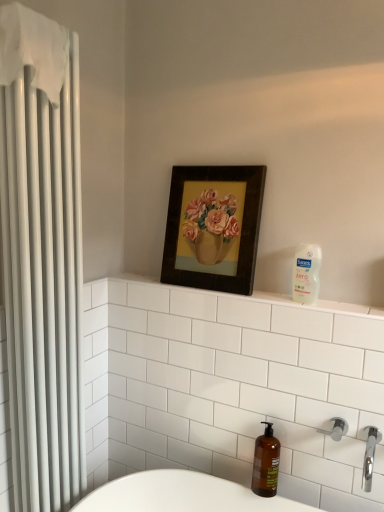
Question: Relative to amber glass soap dispenser at lower right, is satin nickel shower at lower right in front or behind?

Choices:
 (A) behind
 (B) front

Answer: (B)

Question: From the image's perspective, is satin nickel shower at lower right above or below amber glass soap dispenser at lower right?

Choices:
 (A) below
 (B) above

Answer: (B)

Question: Which is nearer to the wooden framed painting of flowers at upper center?

Choices:
 (A) white plastic bottle at upper right
 (B) clear plastic soap dispenser at upper right
 (C) white fabric shower curtain at left
 (D) chrome metallic faucet at lower right
 (E) satin nickel shower at lower right

Answer: (B)

Question: Which object is the farthest from the white fabric shower curtain at left?

Choices:
 (A) amber glass soap dispenser at lower right
 (B) white plastic bottle at upper right
 (C) satin nickel shower at lower right
 (D) chrome metallic faucet at lower right
 (E) clear plastic soap dispenser at upper right

Answer: (C)